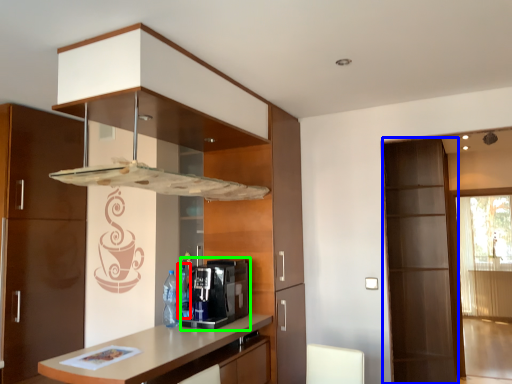
Question: Considering the real-world distances, which object is farthest from bottle (highlighted by a red box)? screen door (highlighted by a blue box) or coffee machine (highlighted by a green box)?

Choices:
 (A) screen door
 (B) coffee machine

Answer: (A)